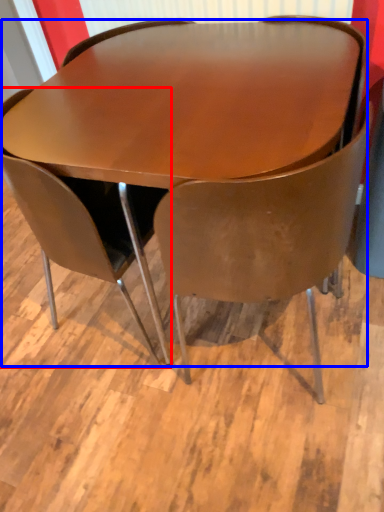
Question: Which object appears closest to the camera in this image, chair (highlighted by a red box) or table (highlighted by a blue box)?

Choices:
 (A) chair
 (B) table

Answer: (B)